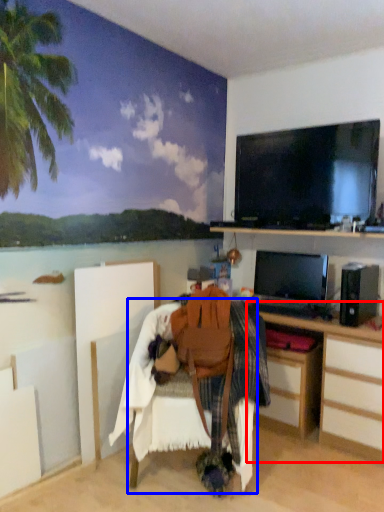
Question: Which point is further to the camera, desk (highlighted by a red box) or chair (highlighted by a blue box)?

Choices:
 (A) desk
 (B) chair

Answer: (A)